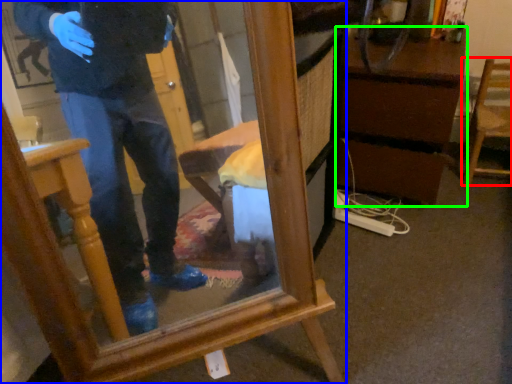
Question: Which object is positioned closest to chair (highlighted by a red box)? Select from furniture (highlighted by a blue box) and vanity (highlighted by a green box).

Choices:
 (A) furniture
 (B) vanity

Answer: (B)